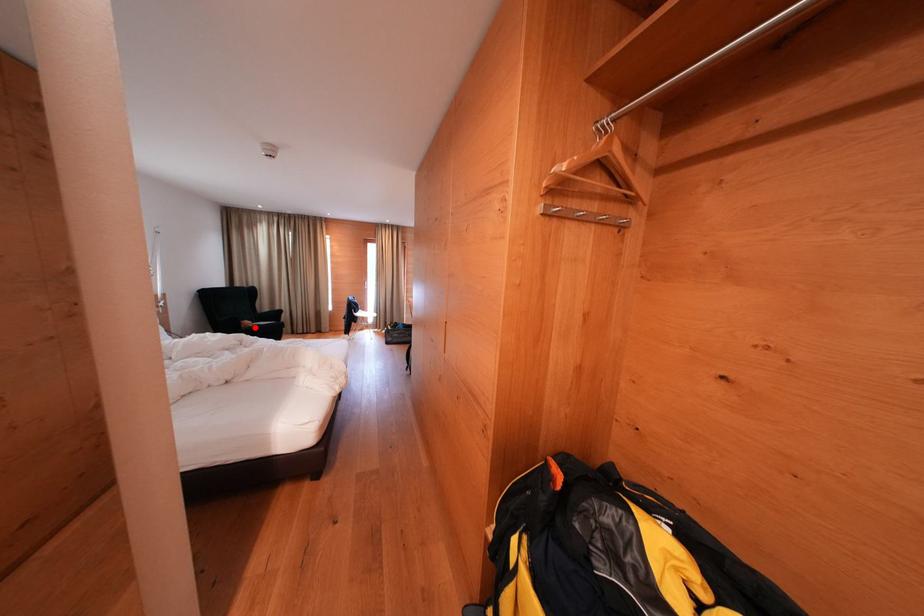
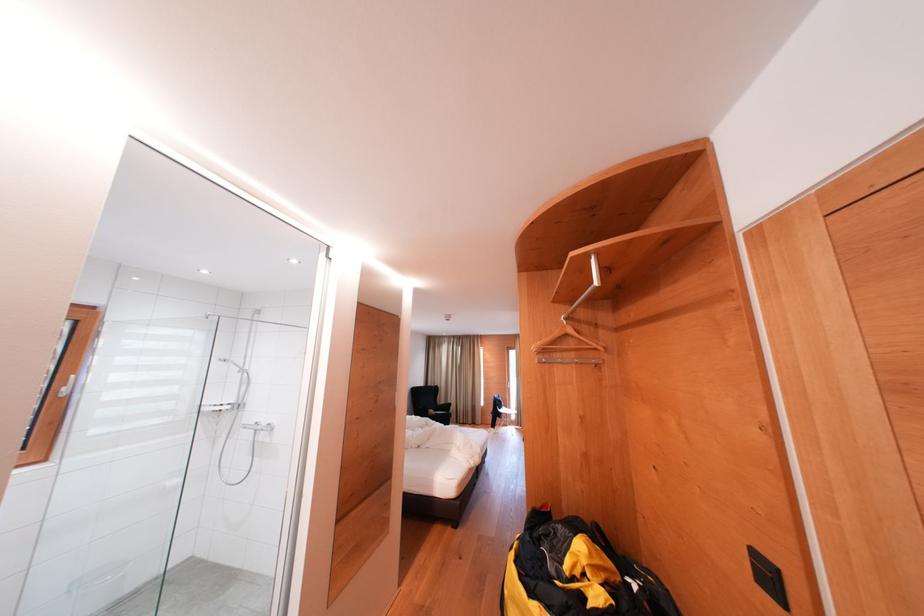
Find the pixel in the second image that matches the highlighted location in the first image.

(439, 416)